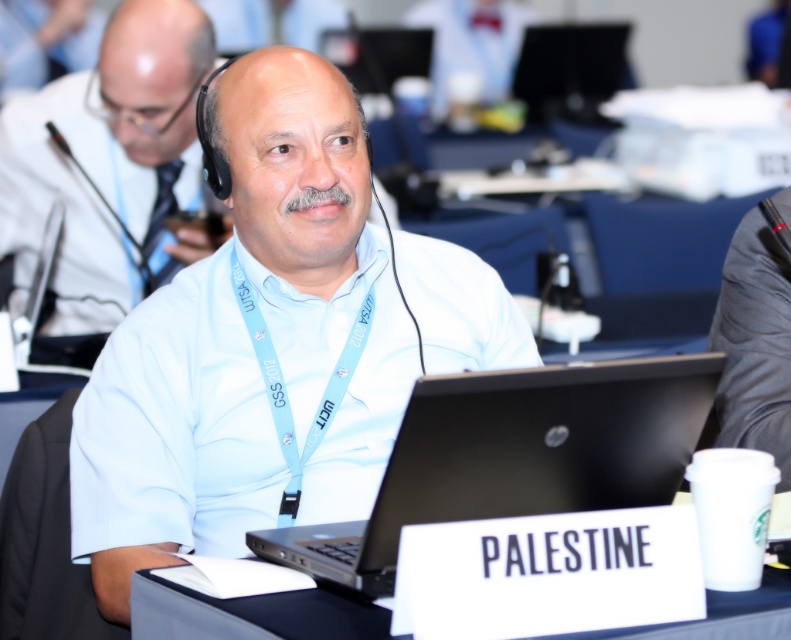
Is point (135, 22) behind point (732, 337)?

Yes, it is.

In the scene shown: Does white matte shirt at center appear over gray fabric suit at right?

Correct, white matte shirt at center is located above gray fabric suit at right.

Is point (108, 35) positioned after point (747, 352)?

Yes, point (108, 35) is farther from viewer.

The height and width of the screenshot is (640, 791). I want to click on white matte shirt at center, so click(112, 164).

Does point (415, 477) come farther from viewer compared to point (759, 346)?

No, (415, 477) is in front of (759, 346).

Is point (524, 456) farther from viewer compared to point (771, 401)?

No.

Image resolution: width=791 pixels, height=640 pixels. Find the location of `black matte laptop at center`. black matte laptop at center is located at coordinates (513, 456).

Is black matte laptop at center wider than light blue fabric lanyard at center?

Yes, black matte laptop at center is wider than light blue fabric lanyard at center.

Does point (534, 371) lie behind point (274, 362)?

That is False.

The height and width of the screenshot is (640, 791). What do you see at coordinates (513, 456) in the screenshot?
I see `black matte laptop at center` at bounding box center [513, 456].

At what (x,y) coordinates should I click in order to perform the action: click on black matte laptop at center. Please return your answer as a coordinate pair (x, y). Looking at the image, I should click on (513, 456).